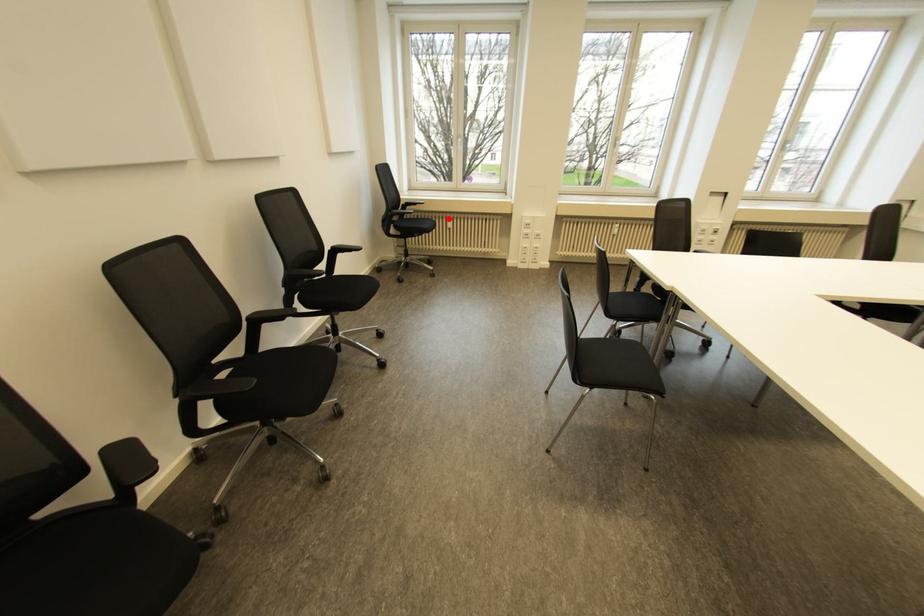
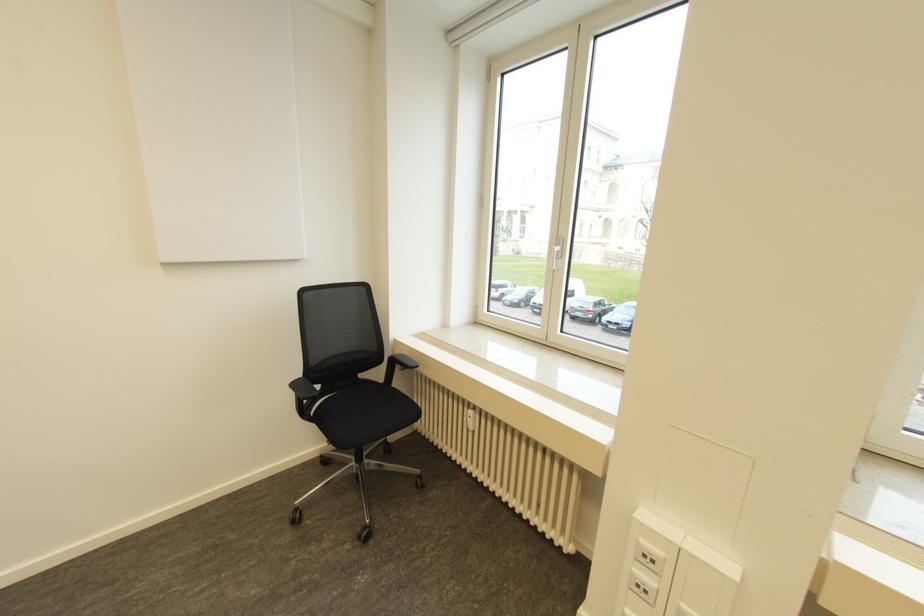
Question: I am providing you with two images of the same scene from different viewpoints. Image1 has a red point marked. In image2, the corresponding 3D location appears at what relative position? Reply with the corresponding letter.

Choices:
 (A) Closer
 (B) Farther

Answer: (B)